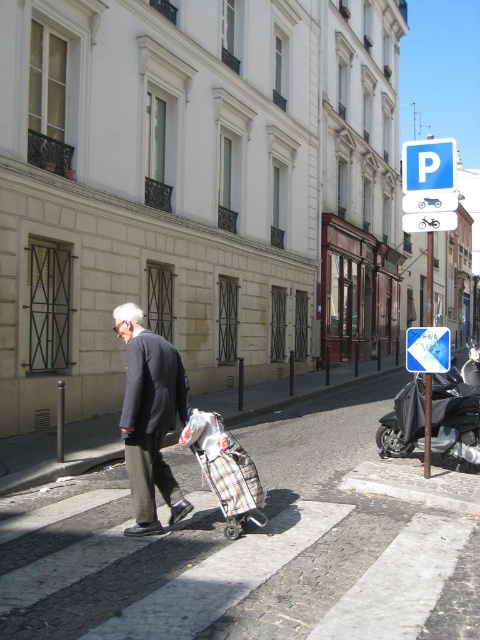
You are a tourist in Paris and you see the white paved crosswalk at center and the black matte motorcycle at lower right. Which object is closer to the street level?

The white paved crosswalk at center is below the black matte motorcycle at lower right, so the crosswalk is closer to the street level.

You are a tourist standing at the entrance of the street scene in Paris. You see a point marked at coordinates (255, 545). According to the image, what does this point correspond to?

→ The point at coordinates (255, 545) corresponds to the white paved crosswalk at center.

Based on the photo, you are a tourist navigating the streets of Paris and see the plaid fabric suitcase at center on the pedestrian crossing. If you want to reach the suitcase quickly, which direction should you move towards from your current position?

The plaid fabric suitcase at center is located at point 0.736 on the x and 0.471 on the y coordinates, so you should move towards the center of the crosswalk to reach it quickly.